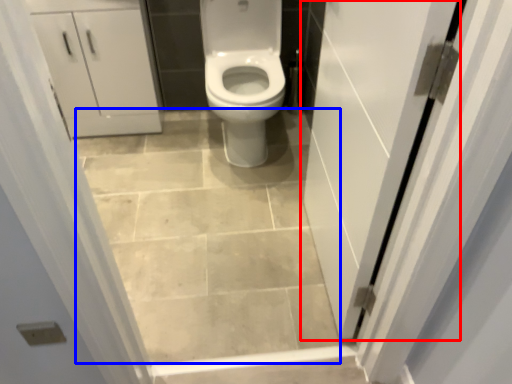
Question: Which point is closer to the camera, door (highlighted by a red box) or ceramic tile (highlighted by a blue box)?

Choices:
 (A) door
 (B) ceramic tile

Answer: (A)